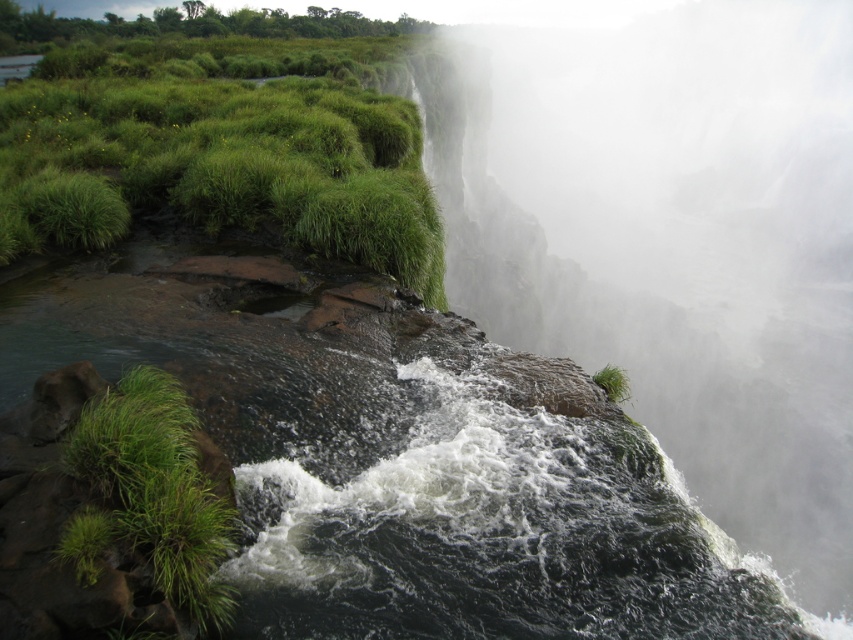
Question: Where is green grassy at upper left located in relation to green grassy tuft at lower left in the image?

Choices:
 (A) above
 (B) below

Answer: (A)

Question: Among these objects, which one is farthest from the camera?

Choices:
 (A) green grassy at upper left
 (B) green grassy tuft at lower left

Answer: (A)

Question: Which point is farther to the camera?

Choices:
 (A) (184, 58)
 (B) (86, 556)

Answer: (A)

Question: Does green grassy at upper left appear on the right side of green grassy tuft at lower left?

Choices:
 (A) no
 (B) yes

Answer: (A)

Question: Does green grassy at upper left have a smaller size compared to green grassy tuft at lower left?

Choices:
 (A) yes
 (B) no

Answer: (B)

Question: Which point is closer to the camera taking this photo?

Choices:
 (A) coord(165,113)
 (B) coord(108,422)

Answer: (B)